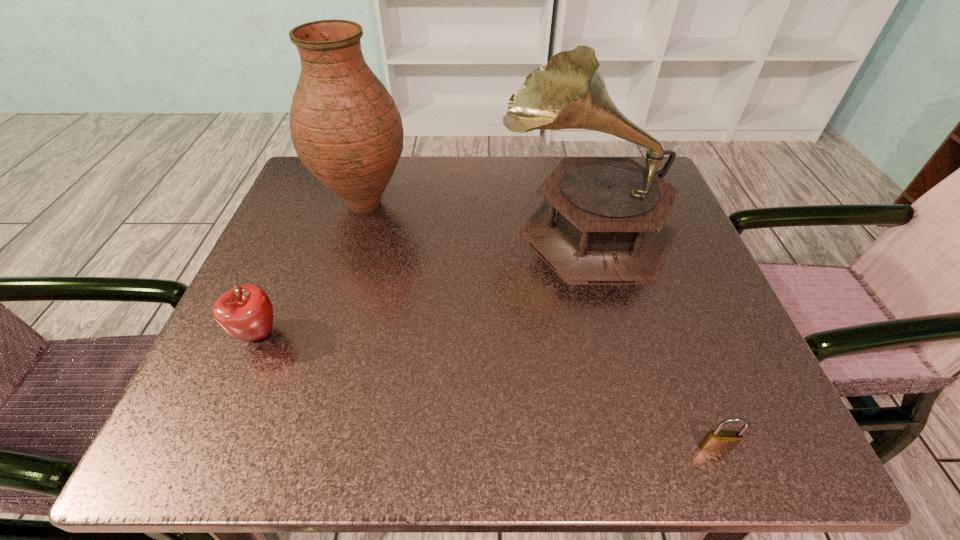
Identify the location of vase. (345, 127).

The height and width of the screenshot is (540, 960). In order to click on phonograph record in this screenshot , I will do pos(603,219).

Locate an element on the screen. This screenshot has height=540, width=960. the third farthest object is located at coordinates (245, 312).

Where is `the second shortest object`? The height and width of the screenshot is (540, 960). the second shortest object is located at coordinates (245, 312).

Identify the location of the shortest object. (716, 441).

The width and height of the screenshot is (960, 540). What are the coordinates of `padlock` in the screenshot? It's located at (716, 441).

You are a GUI agent. You are given a task and a screenshot of the screen. Output one action in this format:
    pyautogui.click(x=<x>, y=<y>)
    Task: Click on the free spot located on the right of the vase
    The height and width of the screenshot is (540, 960).
    Given the screenshot: What is the action you would take?
    pyautogui.click(x=575, y=204)

The width and height of the screenshot is (960, 540). I want to click on free point located 0.290m on the horn direction of the phonograph record, so click(x=357, y=226).

The width and height of the screenshot is (960, 540). Identify the location of free region located 0.310m on the horn direction of the phonograph record. (347, 226).

Locate an element on the screen. vacant area located on the horn direction of the phonograph record is located at coordinates (323, 226).